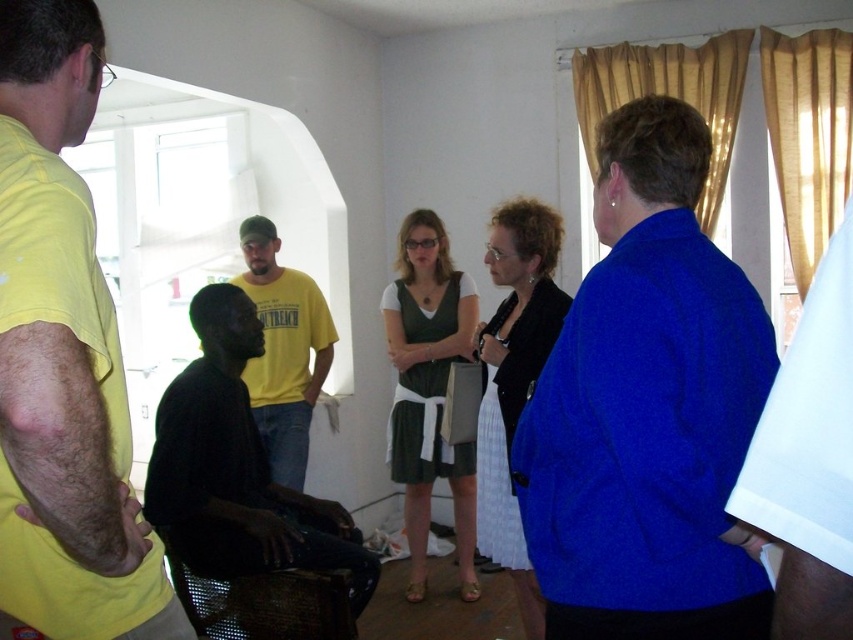
You are organizing a photo shoot and need to arrange two models based on their clothing colors and sizes. The models are wearing the yellow matte shirt at left and the black matte shirt at lower left. Which model should stand in front to ensure both are visible in the photo?

The yellow matte shirt at left should stand in front because it has a lesser height compared to the black matte shirt at lower left, allowing both models to be visible in the photo.

You are standing in the room and want to find the yellow matte shirt at left. According to the coordinates given, where should you look relative to the center of the image?

The yellow matte shirt at left is located at coordinates 0.558 on the x axis and 0.075 on the y axis, which places it slightly to the right and lower center of the image.